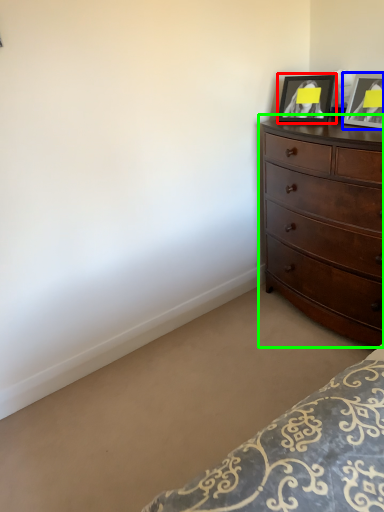
Question: Based on their relative distances, which object is nearer to picture frame (highlighted by a red box)? Choose from picture frame (highlighted by a blue box) and chest of drawers (highlighted by a green box).

Choices:
 (A) picture frame
 (B) chest of drawers

Answer: (A)